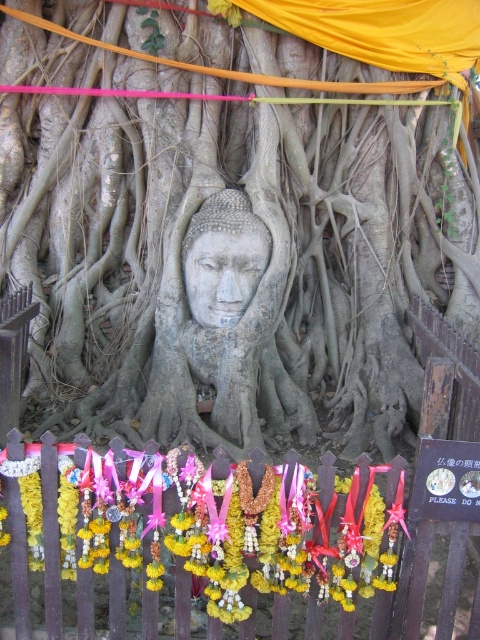
Question: Can you confirm if wooden picket fence at center is positioned below gray stone head at center?

Choices:
 (A) yes
 (B) no

Answer: (A)

Question: Which point is farther to the camera?

Choices:
 (A) yellow fabric garland at lower center
 (B) gray stone buddha head at center
 (C) gray textured roots at center
 (D) wooden picket fence at center

Answer: (C)

Question: Can you confirm if wooden picket fence at center is thinner than gray stone buddha head at center?

Choices:
 (A) no
 (B) yes

Answer: (A)

Question: Based on their relative distances, which object is farther from the gray stone buddha head at center?

Choices:
 (A) gray stone head at center
 (B) yellow fabric garland at lower center
 (C) gray textured roots at center
 (D) wooden picket fence at center

Answer: (D)

Question: Which object is positioned farthest from the gray stone buddha head at center?

Choices:
 (A) wooden picket fence at center
 (B) gray stone head at center
 (C) gray textured roots at center

Answer: (A)

Question: Can you confirm if yellow fabric garland at lower center is positioned above gray stone buddha head at center?

Choices:
 (A) yes
 (B) no

Answer: (B)